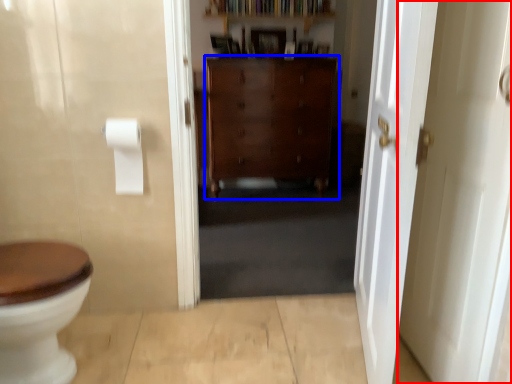
Question: Which point is closer to the camera, door (highlighted by a red box) or cabinetry (highlighted by a blue box)?

Choices:
 (A) door
 (B) cabinetry

Answer: (A)